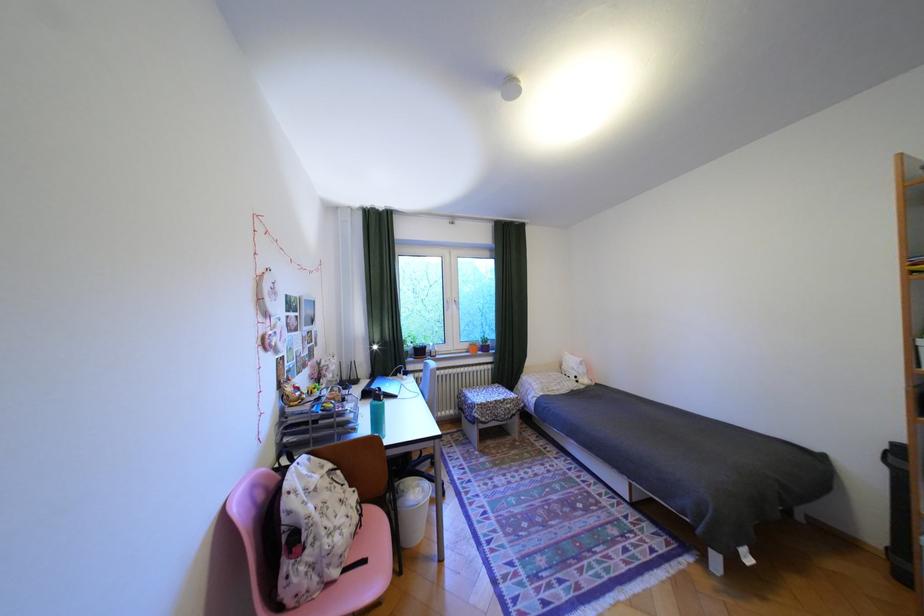
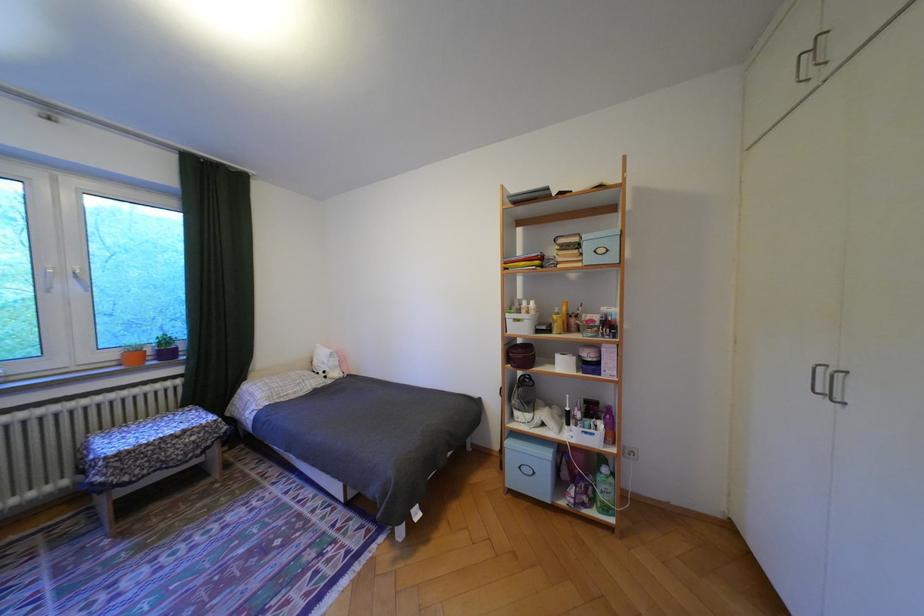
The point at (478, 346) is marked in the first image. Where is the corresponding point in the second image?

(124, 355)